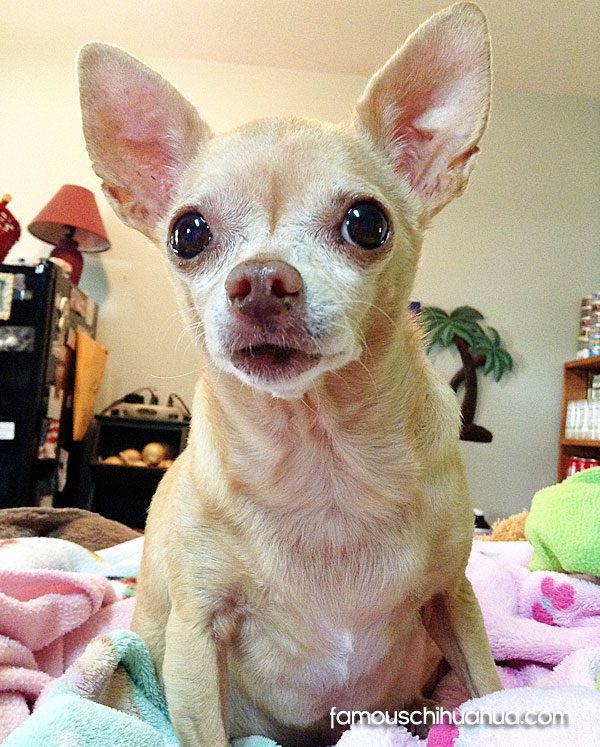
The image size is (600, 747). Find the location of `lampshade`. lampshade is located at coordinates (91, 211).